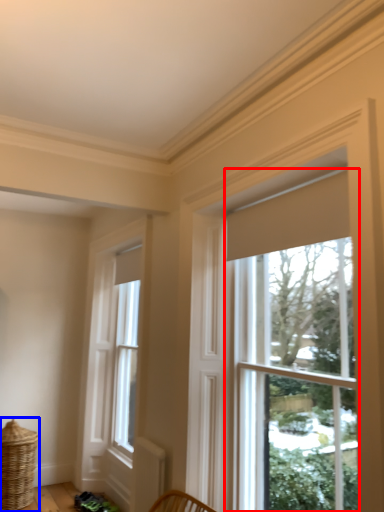
Question: Among these objects, which one is farthest to the camera, window (highlighted by a red box) or basket (highlighted by a blue box)?

Choices:
 (A) window
 (B) basket

Answer: (B)